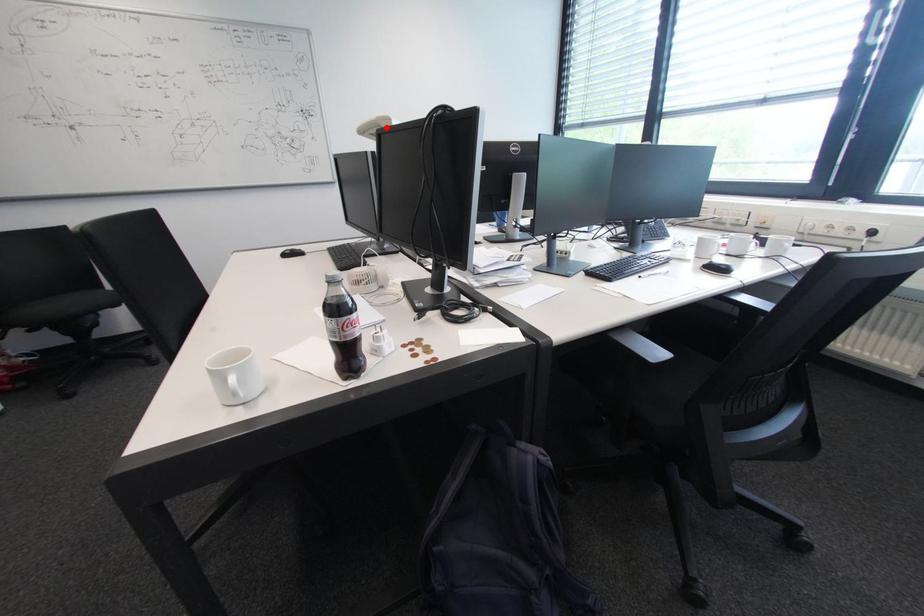
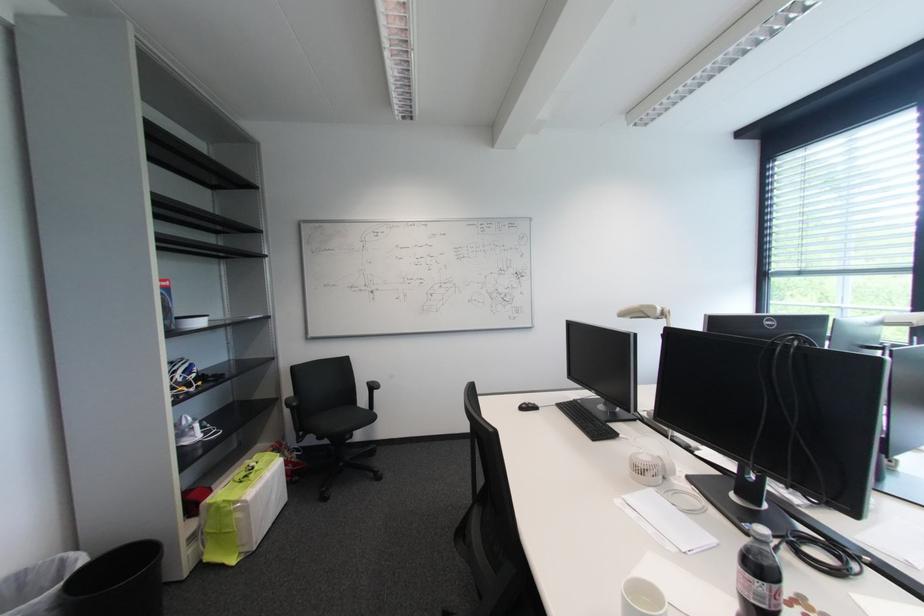
Find the pixel in the second image that matches the highlighted location in the first image.

(649, 314)